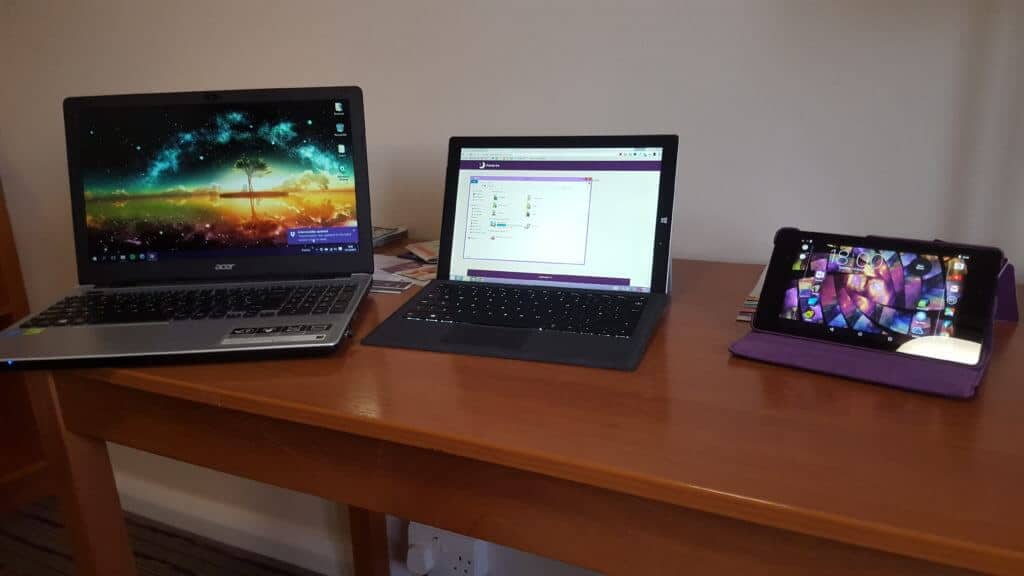
Where is `desk leg`? The image size is (1024, 576). desk leg is located at coordinates (100, 511), (366, 536).